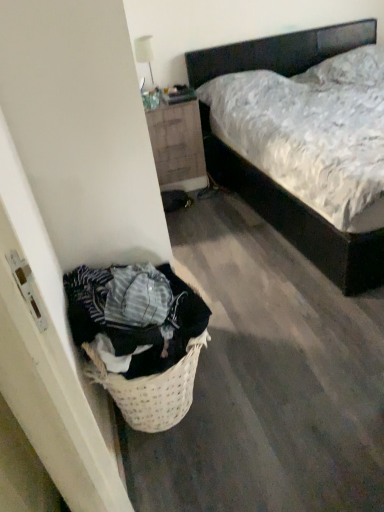
Question: Considering the relative positions of dark wood bed at center and wooden nightstand at upper center in the image provided, is dark wood bed at center in front of wooden nightstand at upper center?

Choices:
 (A) no
 (B) yes

Answer: (B)

Question: Is dark wood bed at center positioned far away from wooden nightstand at upper center?

Choices:
 (A) yes
 (B) no

Answer: (B)

Question: Considering the relative sizes of dark wood bed at center and wooden nightstand at upper center in the image provided, is dark wood bed at center smaller than wooden nightstand at upper center?

Choices:
 (A) no
 (B) yes

Answer: (A)

Question: Considering the relative sizes of dark wood bed at center and wooden nightstand at upper center in the image provided, is dark wood bed at center shorter than wooden nightstand at upper center?

Choices:
 (A) yes
 (B) no

Answer: (B)

Question: Is dark wood bed at center turned away from wooden nightstand at upper center?

Choices:
 (A) no
 (B) yes

Answer: (A)

Question: Does dark wood bed at center appear on the left side of wooden nightstand at upper center?

Choices:
 (A) yes
 (B) no

Answer: (B)

Question: Can we say wooden nightstand at upper center lies outside dark wood bed at center?

Choices:
 (A) yes
 (B) no

Answer: (A)

Question: Is wooden nightstand at upper center wider than dark wood bed at center?

Choices:
 (A) yes
 (B) no

Answer: (B)

Question: Is wooden nightstand at upper center closer to the viewer compared to dark wood bed at center?

Choices:
 (A) yes
 (B) no

Answer: (B)

Question: Does wooden nightstand at upper center have a greater height compared to dark wood bed at center?

Choices:
 (A) yes
 (B) no

Answer: (B)

Question: From the image's perspective, would you say wooden nightstand at upper center is shown under dark wood bed at center?

Choices:
 (A) yes
 (B) no

Answer: (A)

Question: Is wooden nightstand at upper center looking in the opposite direction of dark wood bed at center?

Choices:
 (A) yes
 (B) no

Answer: (B)

Question: From the image's perspective, is wooden nightstand at upper center located above or below dark wood bed at center?

Choices:
 (A) above
 (B) below

Answer: (B)